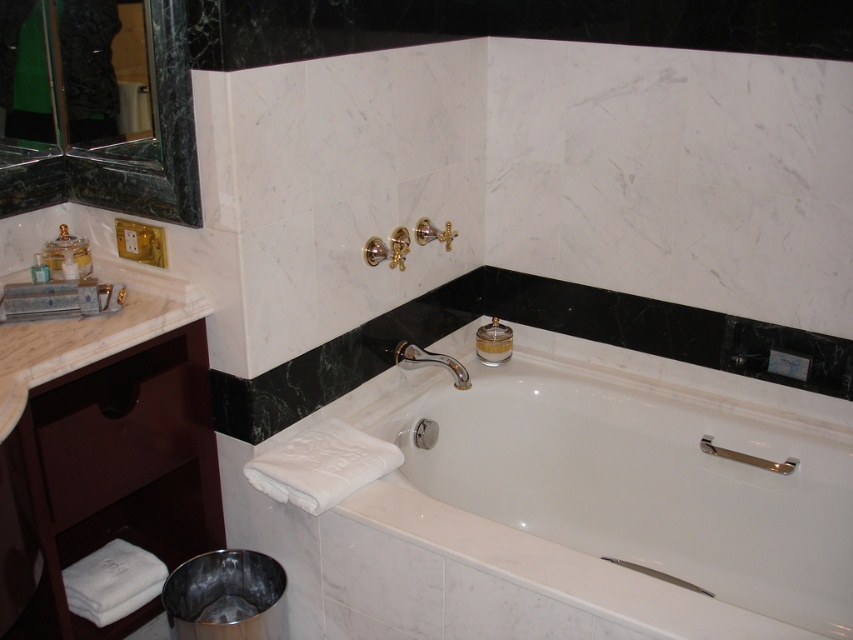
Question: Which point is farther to the camera?

Choices:
 (A) matte gold soap at left
 (B) polished chrome faucet at upper center
 (C) chrome metallic grab bar at lower right

Answer: (B)

Question: Can you confirm if chrome metallic grab bar at lower right is positioned above matte gold soap at left?

Choices:
 (A) yes
 (B) no

Answer: (B)

Question: Which of the following is the farthest from the observer?

Choices:
 (A) polished chrome faucet at upper center
 (B) white glossy bathtub at center
 (C) matte gold soap at left
 (D) chrome metallic grab bar at lower right

Answer: (A)

Question: Can you confirm if chrome metallic grab bar at lower right is wider than matte gold soap at left?

Choices:
 (A) yes
 (B) no

Answer: (A)

Question: Can you confirm if polished chrome faucet at upper center is thinner than matte gold soap at left?

Choices:
 (A) yes
 (B) no

Answer: (B)

Question: Which point is closer to the camera?

Choices:
 (A) chrome metallic grab bar at lower right
 (B) matte gold soap at left
 (C) white glossy bathtub at center
 (D) polished chrome faucet at upper center

Answer: (B)